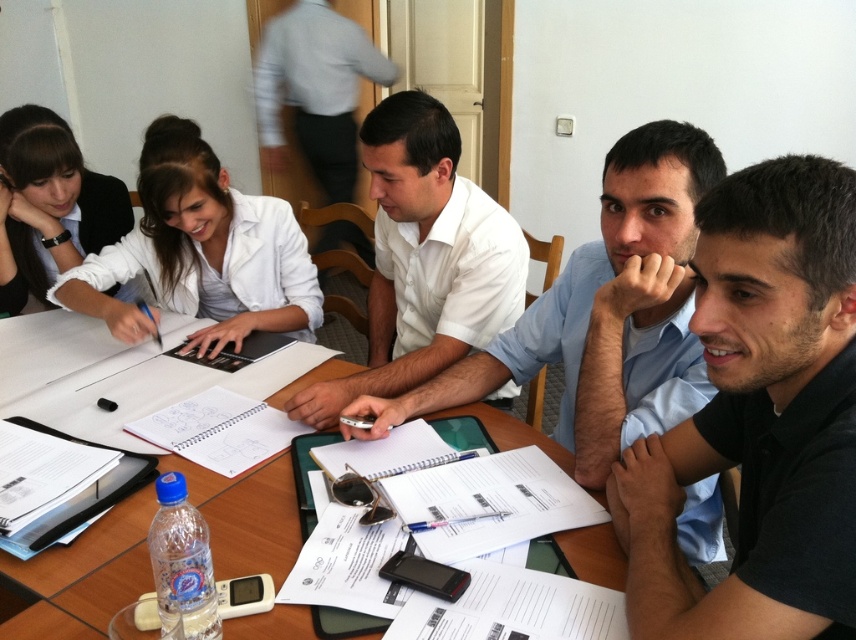
The image size is (856, 640). What do you see at coordinates (759, 417) in the screenshot?
I see `black matte shirt at center` at bounding box center [759, 417].

Who is positioned more to the left, black matte shirt at center or wooden table at center?

wooden table at center is more to the left.

Does point (673, 460) come behind point (244, 556)?

Yes, it is behind point (244, 556).

The width and height of the screenshot is (856, 640). Identify the location of black matte shirt at center. (759, 417).

Based on the photo, between black matte shirt at center and white matte shirt at center, which one appears on the left side from the viewer's perspective?

white matte shirt at center is more to the left.

Between point (749, 547) and point (415, 125), which one is positioned behind?

Positioned behind is point (415, 125).

I want to click on black matte shirt at center, so click(x=759, y=417).

Where is `light blue shirt at center`? Image resolution: width=856 pixels, height=640 pixels. light blue shirt at center is located at coordinates (605, 312).

Locate an element on the screen. The image size is (856, 640). light blue shirt at center is located at coordinates 605,312.